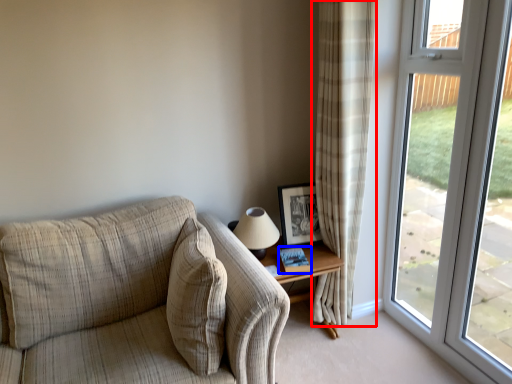
Question: Among these objects, which one is nearest to the camera, curtain (highlighted by a red box) or book (highlighted by a blue box)?

Choices:
 (A) curtain
 (B) book

Answer: (A)